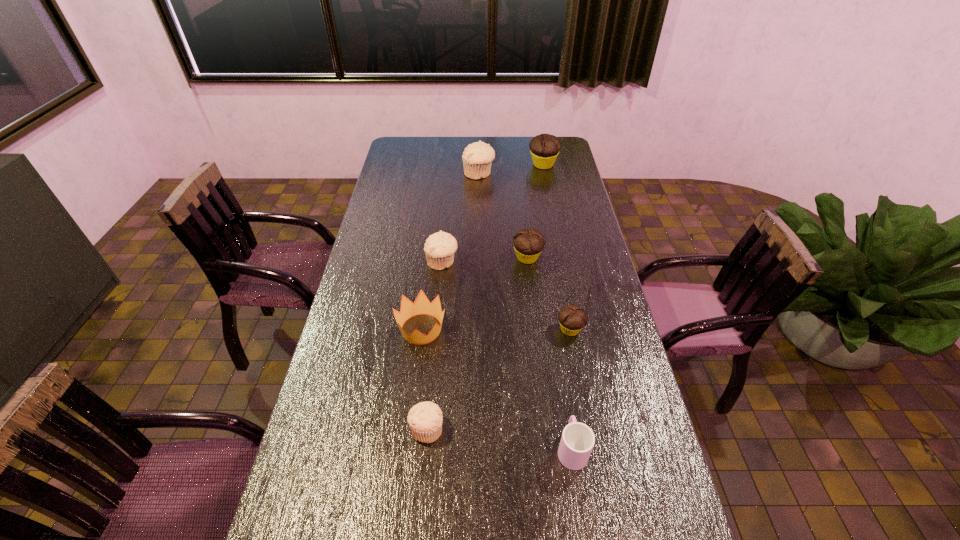
Where is `the farthest beige muffin`? This screenshot has width=960, height=540. the farthest beige muffin is located at coordinates (477, 157).

This screenshot has width=960, height=540. Find the location of `the biggest chocolate muffin`. the biggest chocolate muffin is located at coordinates (544, 148).

Identify the location of the second biggest beige muffin. The image size is (960, 540). (440, 247).

I want to click on the second nearest chocolate muffin, so click(x=528, y=243).

This screenshot has height=540, width=960. Find the location of `crown`. crown is located at coordinates (421, 305).

At what (x,y) coordinates should I click in order to perform the action: click on cup. Please return your answer as a coordinate pair (x, y). The width and height of the screenshot is (960, 540). Looking at the image, I should click on (577, 441).

Locate an element on the screen. The height and width of the screenshot is (540, 960). the nearest muffin is located at coordinates (425, 419).

Where is `the smallest beige muffin`? the smallest beige muffin is located at coordinates (425, 419).

I want to click on the fifth farthest muffin, so click(572, 318).

Where is `the smallest chocolate muffin`? The height and width of the screenshot is (540, 960). the smallest chocolate muffin is located at coordinates (572, 318).